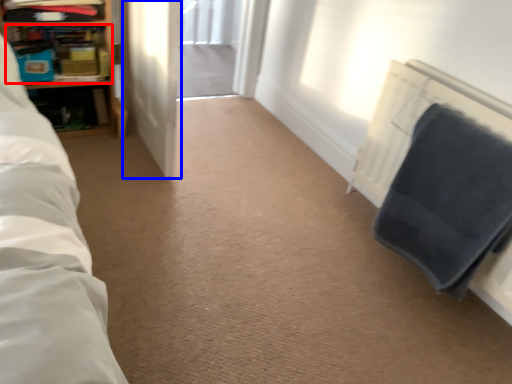
Question: Which object appears farthest to the camera in this image, shelf (highlighted by a red box) or screen door (highlighted by a blue box)?

Choices:
 (A) shelf
 (B) screen door

Answer: (A)